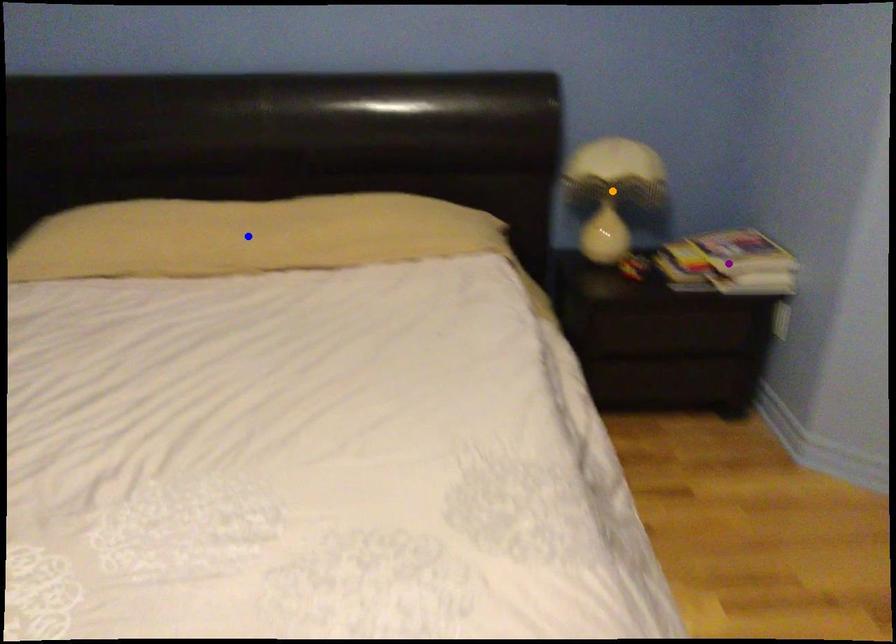
In the scene shown: Order these from nearest to farthest:
A) orange point
B) purple point
C) blue point

blue point < purple point < orange point